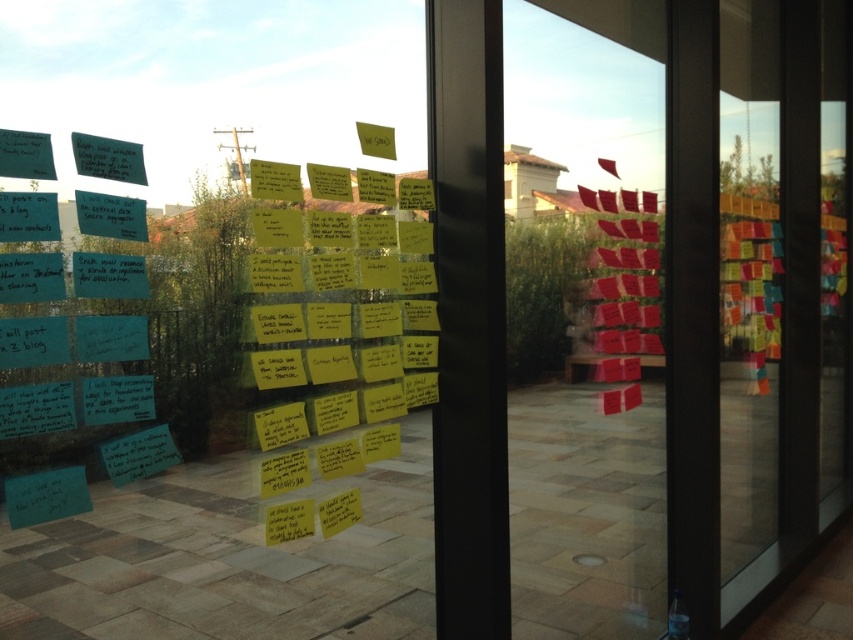
Question: Does transparent glass door at center lie in front of matte paper sign at upper left?

Choices:
 (A) no
 (B) yes

Answer: (A)

Question: Is transparent glass door at center further to the viewer compared to matte paper sign at upper left?

Choices:
 (A) no
 (B) yes

Answer: (B)

Question: Does transparent glass door at center have a larger size compared to matte paper sign at upper left?

Choices:
 (A) yes
 (B) no

Answer: (A)

Question: Which point appears farthest from the camera in this image?

Choices:
 (A) (483, 568)
 (B) (125, 144)

Answer: (A)

Question: Which point is farther from the camera taking this photo?

Choices:
 (A) (109, 170)
 (B) (813, 388)

Answer: (B)